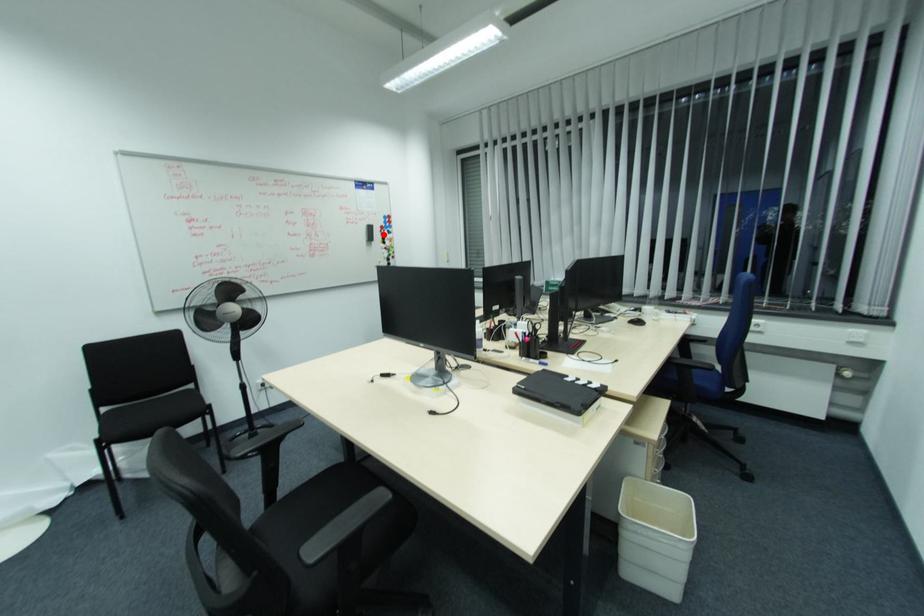
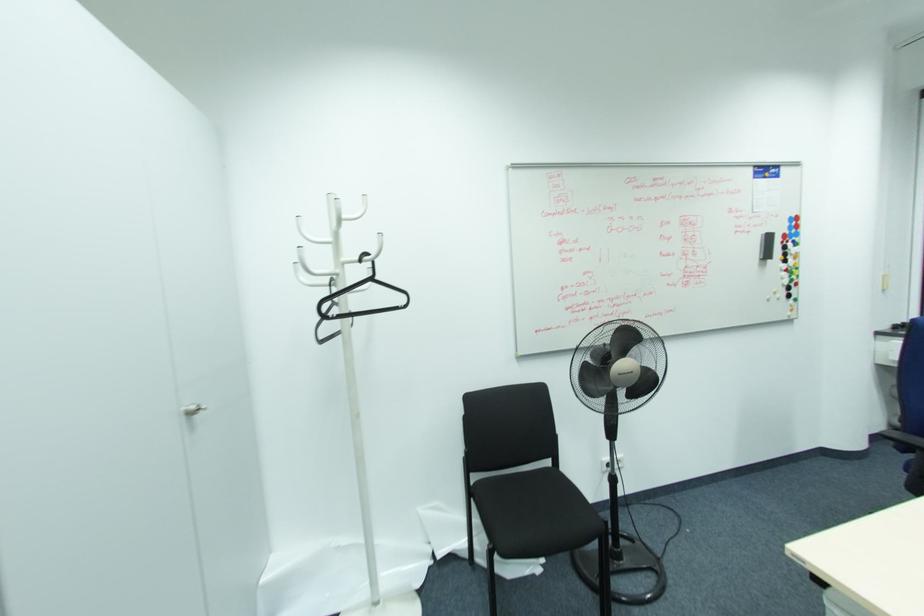
In the second image, find the point that corresponds to the highlighted location in the first image.

(785, 248)